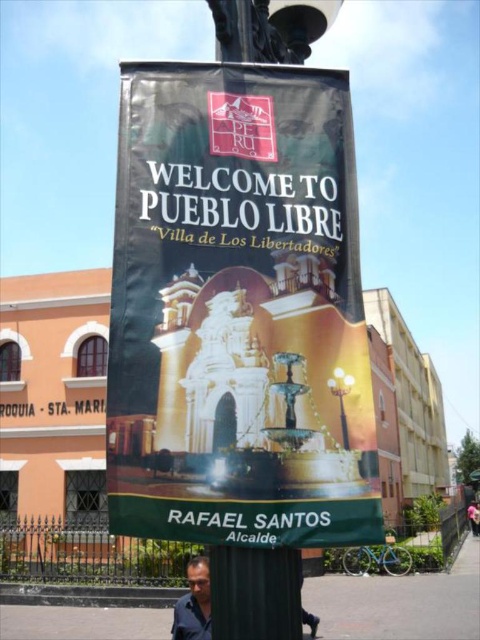
Between black fabric banner at center and metallic silver streetlight at upper center, which one has more height?

black fabric banner at center

Does black fabric banner at center appear under metallic silver streetlight at upper center?

No.

Find the location of a particular element. black fabric banner at center is located at coordinates (238, 308).

This screenshot has height=640, width=480. Find the location of `black fabric banner at center`. black fabric banner at center is located at coordinates (238, 308).

Is point (294, 253) positioned after point (203, 564)?

No.

Between point (116, 512) and point (180, 608), which one is positioned behind?

Positioned behind is point (180, 608).

Identify the location of black fabric banner at center. This screenshot has width=480, height=640. (238, 308).

Locate an element on the screen. This screenshot has width=480, height=640. black fabric banner at center is located at coordinates (238, 308).

Can you confirm if matte black shirt at lower center is positioned above metallic silver streetlight at upper center?

No.

Can you confirm if matte black shirt at lower center is thinner than metallic silver streetlight at upper center?

In fact, matte black shirt at lower center might be wider than metallic silver streetlight at upper center.

Is point (207, 605) less distant than point (338, 401)?

No, it is behind (338, 401).

You are a GUI agent. You are given a task and a screenshot of the screen. Output one action in this format:
    pyautogui.click(x=<x>, y=<y>)
    Task: Click on the matte black shirt at lower center
    This screenshot has width=480, height=640.
    Given the screenshot: What is the action you would take?
    pyautogui.click(x=193, y=604)